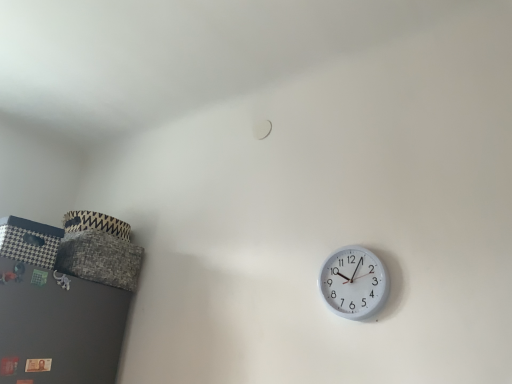
This screenshot has width=512, height=384. What do you see at coordinates (354, 283) in the screenshot?
I see `white plastic wall clock at right` at bounding box center [354, 283].

What is the approximate width of white plastic wall clock at right?

white plastic wall clock at right is 1.52 inches in width.

I want to click on white plastic wall clock at right, so click(354, 283).

At what (x,y) coordinates should I click in order to perform the action: click on white plastic wall clock at right. Please return your answer as a coordinate pair (x, y). The image size is (512, 384). Looking at the image, I should click on (354, 283).